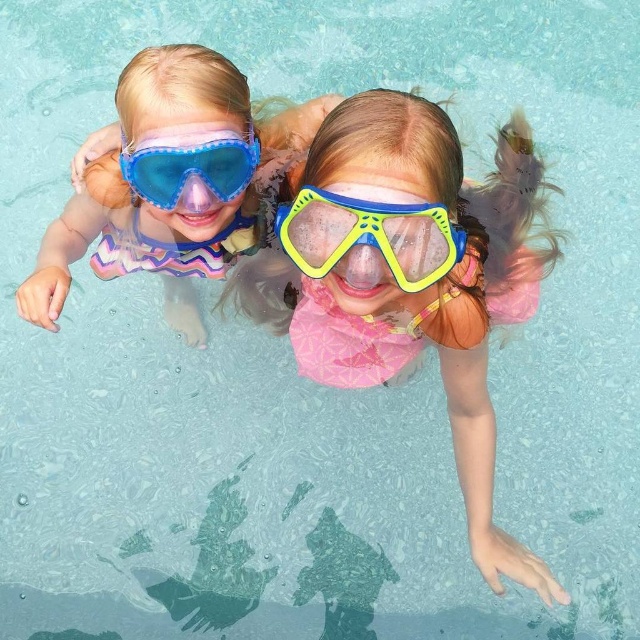
Is point (339, 179) closer to viewer compared to point (422, 234)?

Yes, point (339, 179) is closer to viewer.

In the scene shown: Who is positioned more to the left, blue rubber swimming mask at center or yellow translucent goggles at center?

From the viewer's perspective, yellow translucent goggles at center appears more on the left side.

Who is more distant from viewer, (465, 477) or (397, 253)?

The point (465, 477) is more distant.

You are a GUI agent. You are given a task and a screenshot of the screen. Output one action in this format:
    pyautogui.click(x=<x>, y=<y>)
    Task: Click on the blue rubber swimming mask at center
    This screenshot has height=640, width=640.
    Given the screenshot: What is the action you would take?
    [x=428, y=288]

Does blue rubber swimming mask at center have a lesser height compared to matte blue plastic goggles at upper center?

No.

Looking at this image, who is higher up, blue rubber swimming mask at center or matte blue plastic goggles at upper center?

matte blue plastic goggles at upper center

What do you see at coordinates (428, 288) in the screenshot?
I see `blue rubber swimming mask at center` at bounding box center [428, 288].

Identify the location of blue rubber swimming mask at center. This screenshot has height=640, width=640. (428, 288).

Is blue rubber swimming mask at center bigger than transparent plastic goggles at upper center?

Indeed, blue rubber swimming mask at center has a larger size compared to transparent plastic goggles at upper center.

Measure the distance between blue rubber swimming mask at center and transparent plastic goggles at upper center.

blue rubber swimming mask at center and transparent plastic goggles at upper center are 15.85 inches apart.

You are a GUI agent. You are given a task and a screenshot of the screen. Output one action in this format:
    pyautogui.click(x=<x>, y=<y>)
    Task: Click on the blue rubber swimming mask at center
    
    Given the screenshot: What is the action you would take?
    point(428,288)

The width and height of the screenshot is (640, 640). Identify the location of blue rubber swimming mask at center. (428, 288).